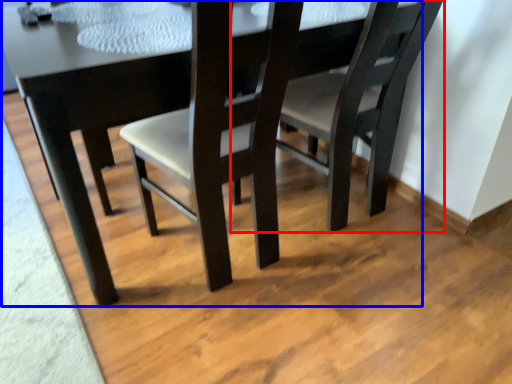
Question: Which object is closer to the camera taking this photo, chair (highlighted by a red box) or table (highlighted by a blue box)?

Choices:
 (A) chair
 (B) table

Answer: (B)